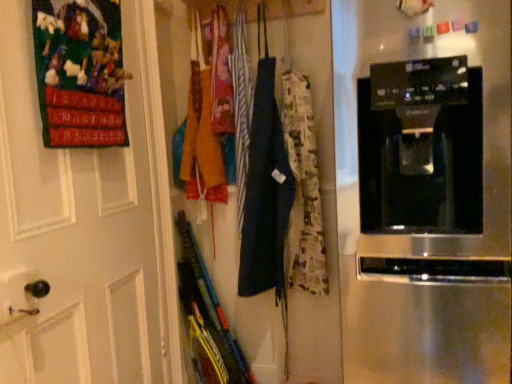
Question: Considering the positions of point (317, 51) and point (217, 82), is point (317, 51) closer or farther from the camera than point (217, 82)?

Choices:
 (A) closer
 (B) farther

Answer: (A)

Question: Considering the positions of dark blue fabric apron at center and printed fabric apron at center in the image, is dark blue fabric apron at center wider or thinner than printed fabric apron at center?

Choices:
 (A) thin
 (B) wide

Answer: (B)

Question: Which is nearer to the black glossy coffee maker at center?

Choices:
 (A) printed fabric apron at center
 (B) dark blue fabric apron at center
 (C) white matte door at upper left

Answer: (B)

Question: Which object is positioned farthest from the white matte door at upper left?

Choices:
 (A) dark blue fabric apron at center
 (B) printed fabric apron at center
 (C) black glossy coffee maker at center

Answer: (C)